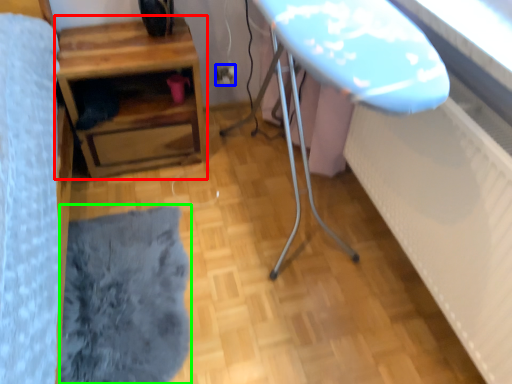
Question: Considering the real-world distances, which object is farthest from table (highlighted by a red box)? electric outlet (highlighted by a blue box) or flat (highlighted by a green box)?

Choices:
 (A) electric outlet
 (B) flat

Answer: (B)